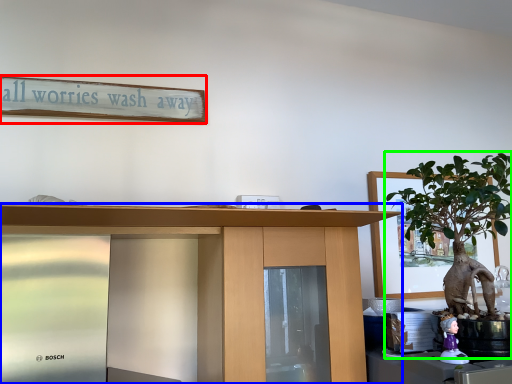
Question: Which object is positioned farthest from bulletin board (highlighted by a red box)? Select from desk (highlighted by a blue box) and houseplant (highlighted by a green box).

Choices:
 (A) desk
 (B) houseplant

Answer: (B)